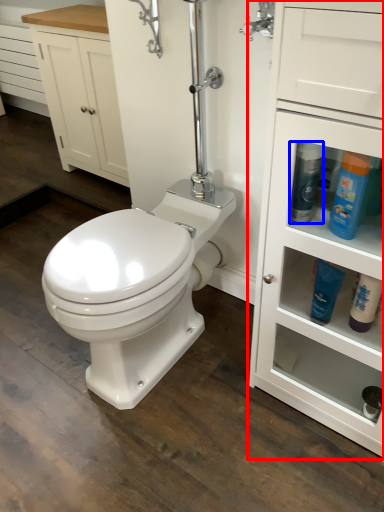
Question: Which of the following is the farthest to the observer, bathroom cabinet (highlighted by a red box) or cleaning product (highlighted by a blue box)?

Choices:
 (A) bathroom cabinet
 (B) cleaning product

Answer: (B)